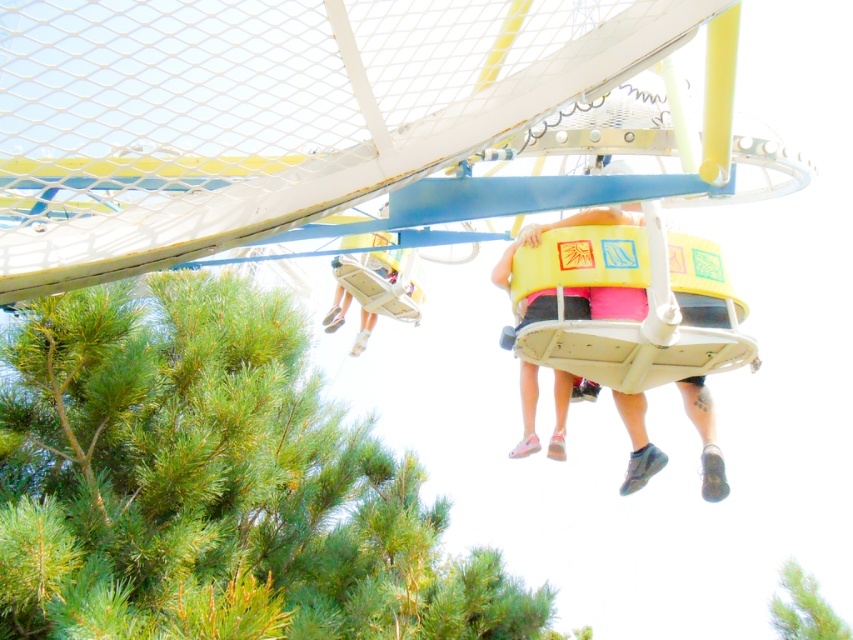
From the picture: Does green leafy tree at lower left appear on the right side of yellow plastic bucket at center?

Indeed, green leafy tree at lower left is positioned on the right side of yellow plastic bucket at center.

Who is taller, green leafy tree at lower left or yellow plastic bucket at center?

green leafy tree at lower left

What are the coordinates of `green leafy tree at lower left` in the screenshot? It's located at (213, 484).

Does yellow matte seat at center lie behind yellow plastic bucket at center?

No, yellow matte seat at center is in front of yellow plastic bucket at center.

Which is below, yellow matte seat at center or yellow plastic bucket at center?

yellow matte seat at center is below.

Locate an element on the screen. Image resolution: width=853 pixels, height=640 pixels. yellow matte seat at center is located at coordinates (704, 435).

Identify the location of yellow matte seat at center. The width and height of the screenshot is (853, 640). (704, 435).

Does green leafy tree at lower left have a smaller size compared to yellow matte seat at center?

Incorrect, green leafy tree at lower left is not smaller in size than yellow matte seat at center.

Who is positioned more to the left, green leafy tree at lower left or yellow matte seat at center?

Positioned to the left is green leafy tree at lower left.

Does point (422, 474) come closer to viewer compared to point (631, 424)?

That is False.

Where is `green leafy tree at lower left`? The image size is (853, 640). green leafy tree at lower left is located at coordinates (213, 484).